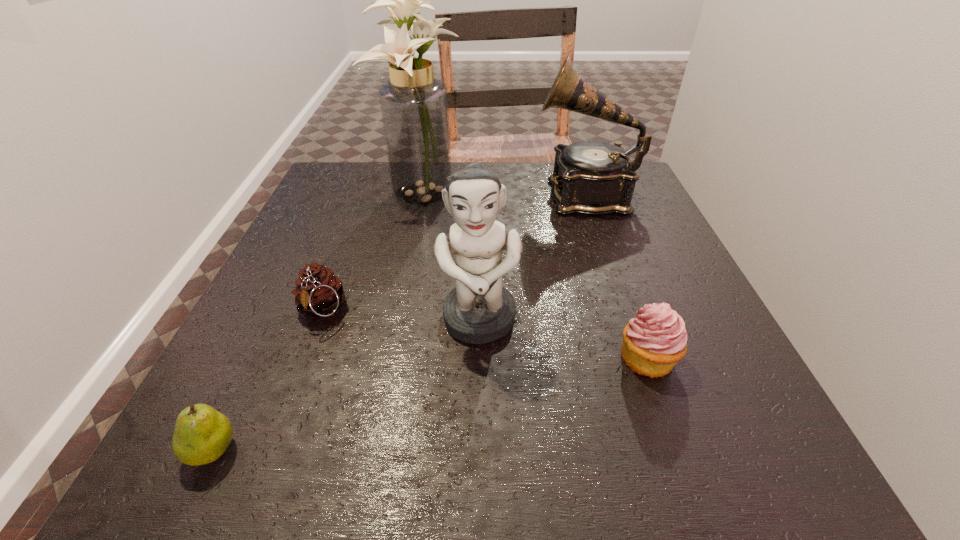
Image resolution: width=960 pixels, height=540 pixels. Find the location of `vacant space situated on the front-facing side of the figurine`. vacant space situated on the front-facing side of the figurine is located at coordinates (479, 397).

Image resolution: width=960 pixels, height=540 pixels. In order to click on vacant space located on the back of the cupcake in this screenshot , I will do `click(621, 285)`.

Image resolution: width=960 pixels, height=540 pixels. In order to click on vacant space located 0.230m with a leaf charm attached to the pinecone in this screenshot , I will do `click(262, 467)`.

Identify the location of free location located 0.330m on the right of the pear. coord(485,450).

Find the location of `flower arrangement that is at the far edge`. flower arrangement that is at the far edge is located at coordinates (414, 107).

I want to click on phonograph record located at the far edge, so click(590, 177).

Locate an element on the screen. Image resolution: width=960 pixels, height=540 pixels. object positioned at the near edge is located at coordinates (202, 434).

Image resolution: width=960 pixels, height=540 pixels. I want to click on flower arrangement that is at the left edge, so click(414, 107).

Where is `pinecone that is positioned at the left edge`? The height and width of the screenshot is (540, 960). pinecone that is positioned at the left edge is located at coordinates (319, 292).

Locate an element on the screen. This screenshot has height=540, width=960. pear located in the left edge section of the desktop is located at coordinates (202, 434).